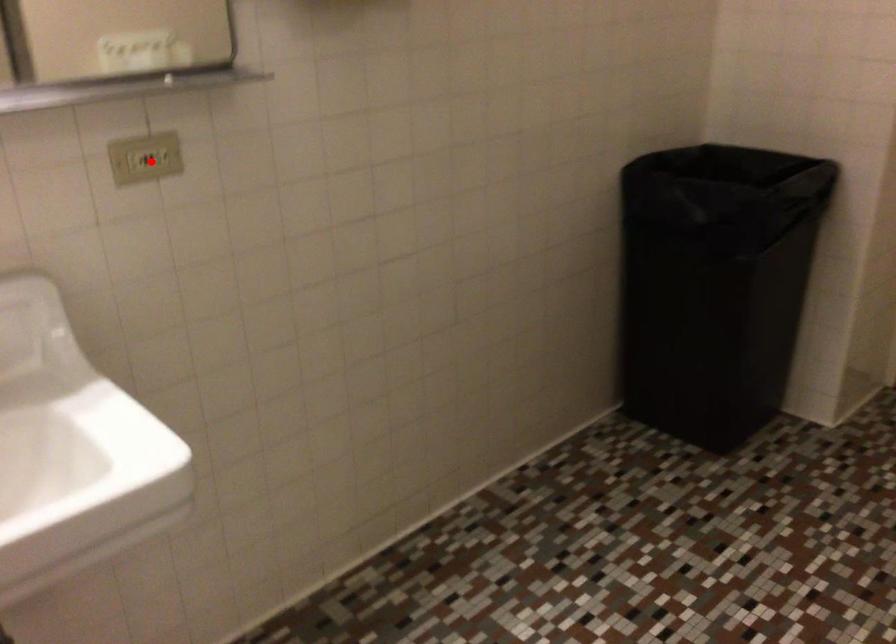
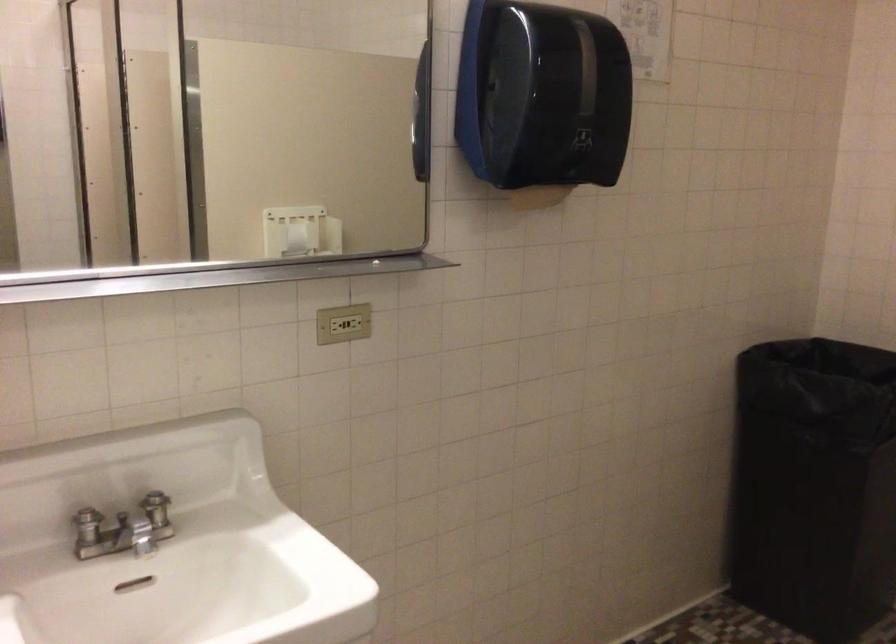
Question: I am providing you with two images of the same scene from different viewpoints. Image1 has a red point marked. In image2, the corresponding 3D location appears at what relative position? Reply with the corresponding letter.

Choices:
 (A) Closer
 (B) Farther

Answer: (B)